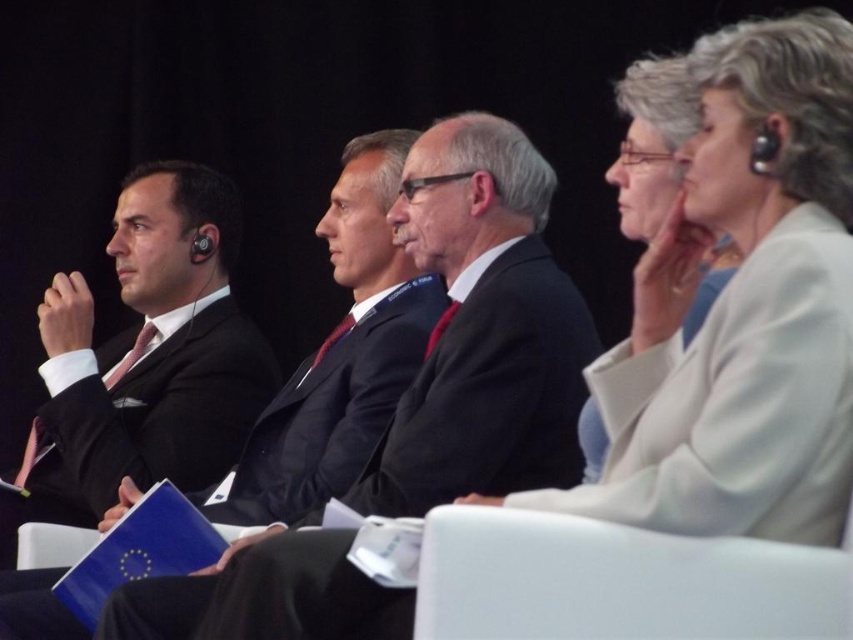
You are standing in front of the group of four individuals at the formal event. You notice two points marked in the image. The first point is at coordinates point (527, 449) and the second point is at point (369, 424). Which of these two points is closer to you?

Point (527, 449) is in front of point (369, 424), so it is closer to you.

You are a photographer at a formal event and need to adjust the camera focus to ensure both the matte black suit at left and the matte black suit at center are clearly visible. Since the camera has a limited depth of field, you must determine which suit is closer to the camera to prioritize focus. Based on the scene description, which suit is closer?

The matte black suit at left is taller than the matte black suit at center, which suggests it is closer to the camera. Therefore, the matte black suit at left is closer to the camera.

You are standing in front of a group of four people seated in a formal setting. There is a point at coordinates point (496, 486). Can you estimate how far this point is from your current position?

The distance between point (496, 486) and the viewer is 9.62 feet.